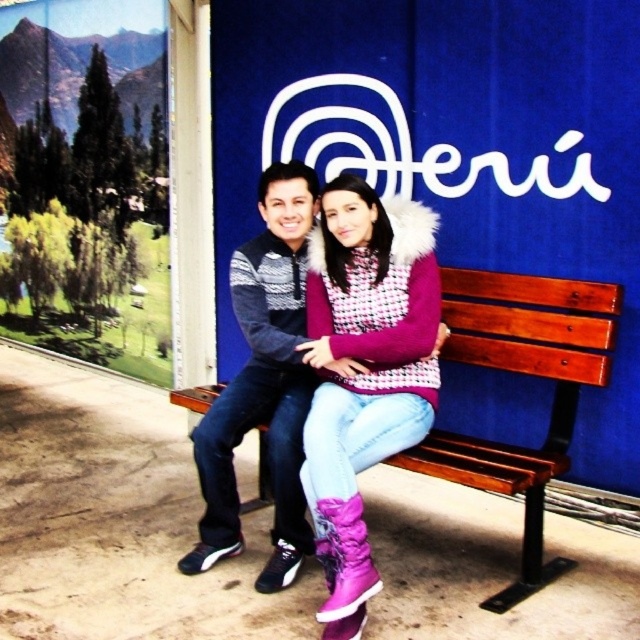
Question: Which point is closer to the camera?

Choices:
 (A) blue fabric peru sign at center
 (B) dark gray knit sweater at center

Answer: (B)

Question: Can you confirm if purple suede boots at center is smaller than dark gray knit sweater at center?

Choices:
 (A) yes
 (B) no

Answer: (B)

Question: Does purple suede boots at center lie in front of dark gray knit sweater at center?

Choices:
 (A) no
 (B) yes

Answer: (B)

Question: Is blue fabric peru sign at center to the right of purple suede boots at center from the viewer's perspective?

Choices:
 (A) no
 (B) yes

Answer: (B)

Question: Which object appears closest to the camera in this image?

Choices:
 (A) dark gray knit sweater at center
 (B) purple suede boots at center
 (C) blue fabric peru sign at center
 (D) wooden bench at center

Answer: (B)

Question: Which object is closer to the camera taking this photo?

Choices:
 (A) purple suede boots at center
 (B) wooden bench at center
 (C) blue fabric peru sign at center

Answer: (A)